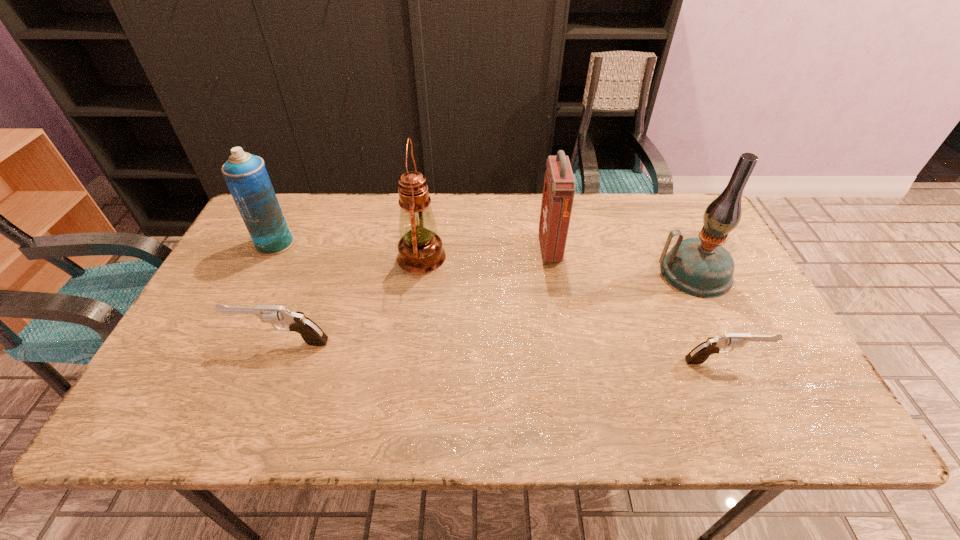
In order to click on gun positioned at the left edge in this screenshot , I will do `click(312, 334)`.

I want to click on aerosol can that is at the left edge, so click(x=245, y=174).

Image resolution: width=960 pixels, height=540 pixels. Identify the location of gun positioned at the right edge. (698, 355).

The image size is (960, 540). I want to click on oil lamp at the right edge, so click(701, 267).

I want to click on object that is positioned at the far left corner, so click(x=245, y=174).

This screenshot has width=960, height=540. I want to click on object located in the near right corner section of the desktop, so click(x=698, y=355).

In the image, there is a desktop. Where is `vacant space at the far edge`? vacant space at the far edge is located at coordinates (597, 199).

In the image, there is a desktop. What are the coordinates of `vacant space at the near edge` in the screenshot? It's located at (520, 368).

Identify the location of free space at the left edge of the desktop. Image resolution: width=960 pixels, height=540 pixels. (230, 275).

In the image, there is a desktop. At what (x,y) coordinates should I click in order to perform the action: click on blank space at the right edge. Please return your answer as a coordinate pair (x, y). This screenshot has width=960, height=540. Looking at the image, I should click on (706, 329).